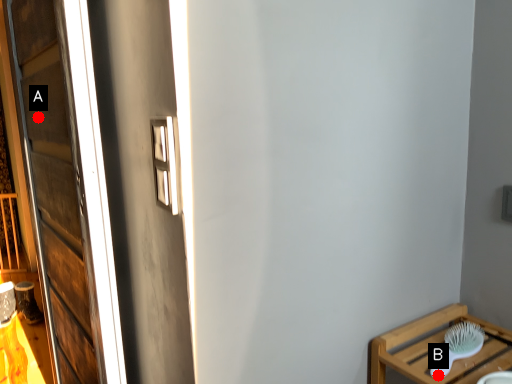
Question: Two points are circled on the image, labeled by A and B beside each circle. Which point appears farthest from the camera in this image?

Choices:
 (A) A is further
 (B) B is further

Answer: (A)